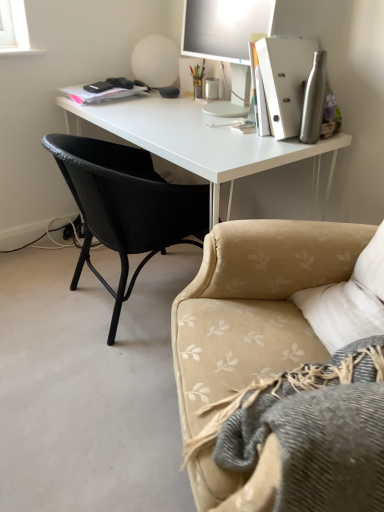
Question: Could you tell me if white matte desk at center is turned towards beige floral fabric couch at lower right?

Choices:
 (A) yes
 (B) no

Answer: (B)

Question: Does white matte desk at center have a greater height compared to beige floral fabric couch at lower right?

Choices:
 (A) no
 (B) yes

Answer: (B)

Question: From a real-world perspective, is white matte desk at center positioned over beige floral fabric couch at lower right based on gravity?

Choices:
 (A) yes
 (B) no

Answer: (B)

Question: Does white matte desk at center have a greater width compared to beige floral fabric couch at lower right?

Choices:
 (A) no
 (B) yes

Answer: (B)

Question: From a real-world perspective, is white matte desk at center physically below beige floral fabric couch at lower right?

Choices:
 (A) no
 (B) yes

Answer: (B)

Question: From the image's perspective, is black woven chair at left above or below white matte desk at center?

Choices:
 (A) above
 (B) below

Answer: (B)

Question: Considering the positions of black woven chair at left and white matte desk at center in the image, is black woven chair at left bigger or smaller than white matte desk at center?

Choices:
 (A) small
 (B) big

Answer: (A)

Question: Is black woven chair at left taller or shorter than white matte desk at center?

Choices:
 (A) tall
 (B) short

Answer: (B)

Question: Choose the correct answer: Is black woven chair at left inside white matte desk at center or outside it?

Choices:
 (A) outside
 (B) inside

Answer: (B)

Question: Is white matte desk at center inside the boundaries of silver metallic water bottle at right, or outside?

Choices:
 (A) outside
 (B) inside

Answer: (A)

Question: Looking at the image, does white matte desk at center seem bigger or smaller compared to silver metallic water bottle at right?

Choices:
 (A) big
 (B) small

Answer: (A)

Question: Considering the positions of white matte desk at center and silver metallic water bottle at right in the image, is white matte desk at center wider or thinner than silver metallic water bottle at right?

Choices:
 (A) thin
 (B) wide

Answer: (B)

Question: From a real-world perspective, is white matte desk at center physically located above or below silver metallic water bottle at right?

Choices:
 (A) below
 (B) above

Answer: (A)

Question: Does point (130, 192) appear closer or farther from the camera than point (196, 29)?

Choices:
 (A) closer
 (B) farther

Answer: (A)

Question: In terms of size, does black woven chair at left appear bigger or smaller than matte silver monitor at upper right?

Choices:
 (A) big
 (B) small

Answer: (A)